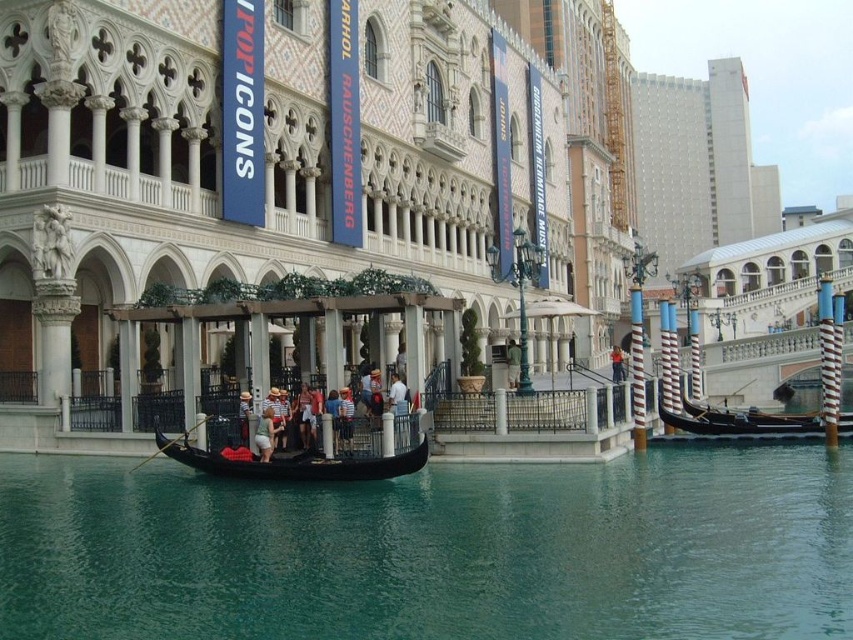
You are standing on the dock and see the teal glossy water at center and the light blue denim jeans at center. Which object is closer to the water surface?

The light blue denim jeans at center are located above the teal glossy water at center, so the teal glossy water at center is closer to the water surface.

You are standing on the dock and see the black polished wood gondola at right and the light blue denim jeans at center. Which object is nearer to you?

The black polished wood gondola at right is closer to the viewer than the light blue denim jeans at center.